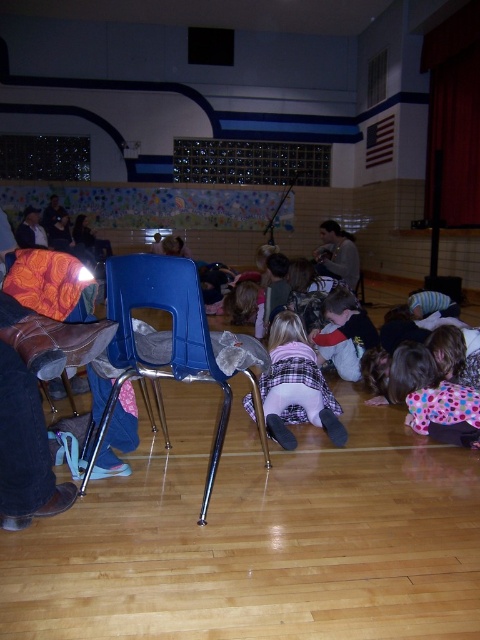
You are organizing a school event and need to move the blue plastic chair at center. Where will you find the polka dot fabric dress at lower right?

The polka dot fabric dress at lower right is located underneath the blue plastic chair at center.

You are a photographer setting up a shoot in the gymnasium. You need to decide which garment to use as a prop. The plaid fabric pants at center and the polka dot fabric dress at lower right are both available. Based on their widths, which one would you choose if you want a wider prop?

The plaid fabric pants at center might be wider than the polka dot fabric dress at lower right, so you should choose the plaid fabric pants at center as the prop if you want a wider option.

You are standing in the gymnasium and see the plaid fabric pants at center and the polka dot fabric dress at lower right. Which clothing item is nearer to you?

The plaid fabric pants at center is closer to the viewer than the polka dot fabric dress at lower right.